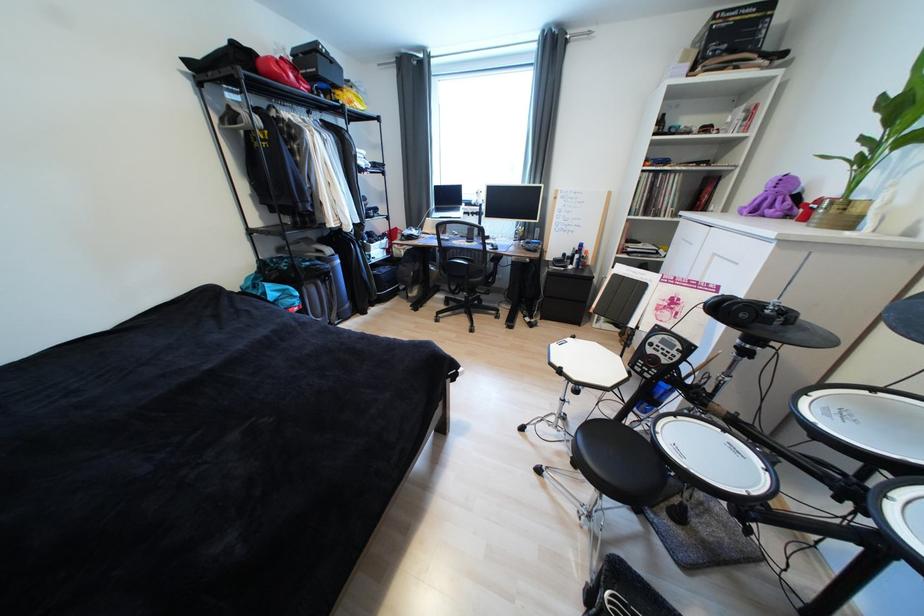
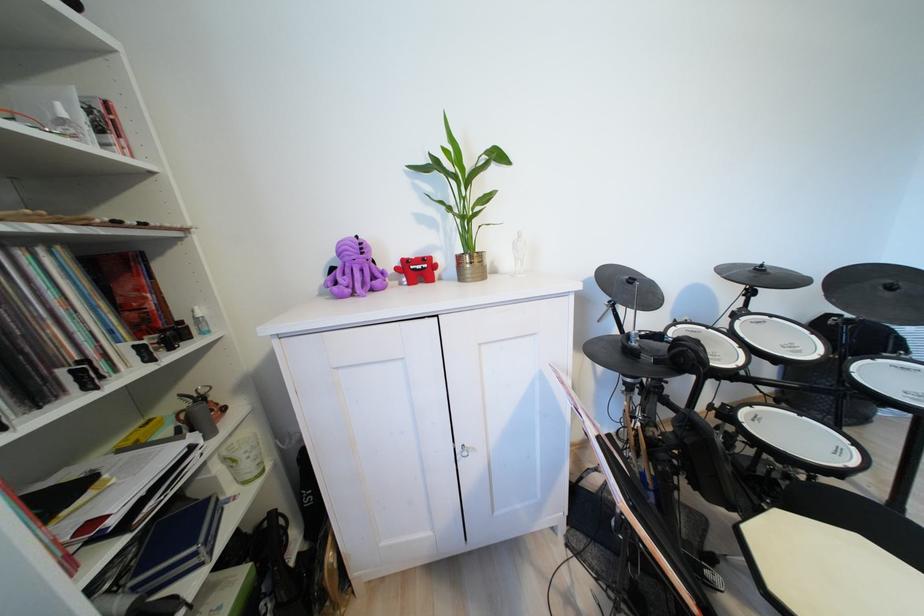
In the second image, find the point that corresponds to (x=843, y=209) in the first image.

(482, 262)